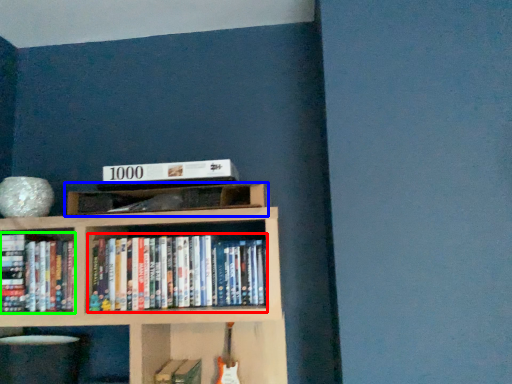
Question: Based on their relative distances, which object is nearer to book (highlighted by a red box)? Choose from shelf (highlighted by a blue box) and book (highlighted by a green box).

Choices:
 (A) shelf
 (B) book

Answer: (A)